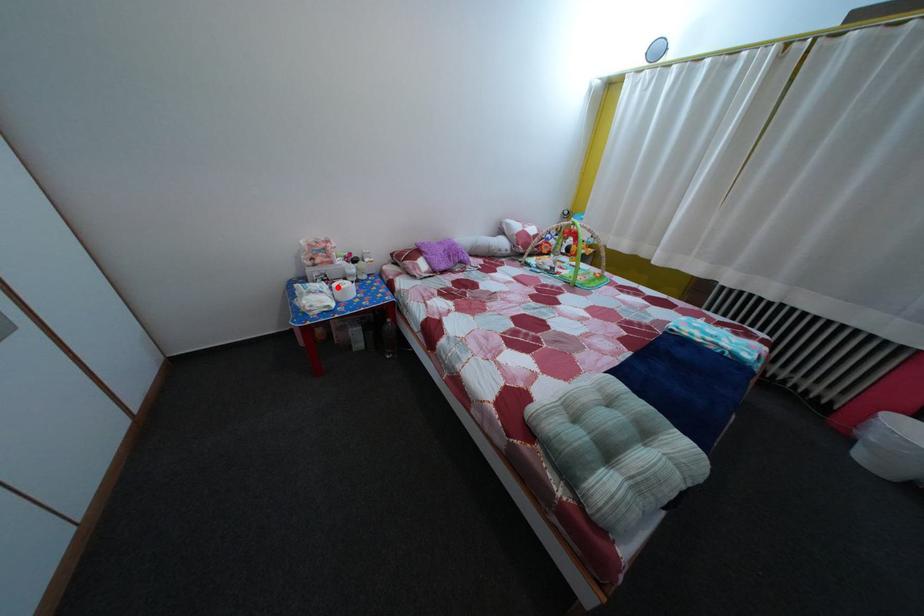
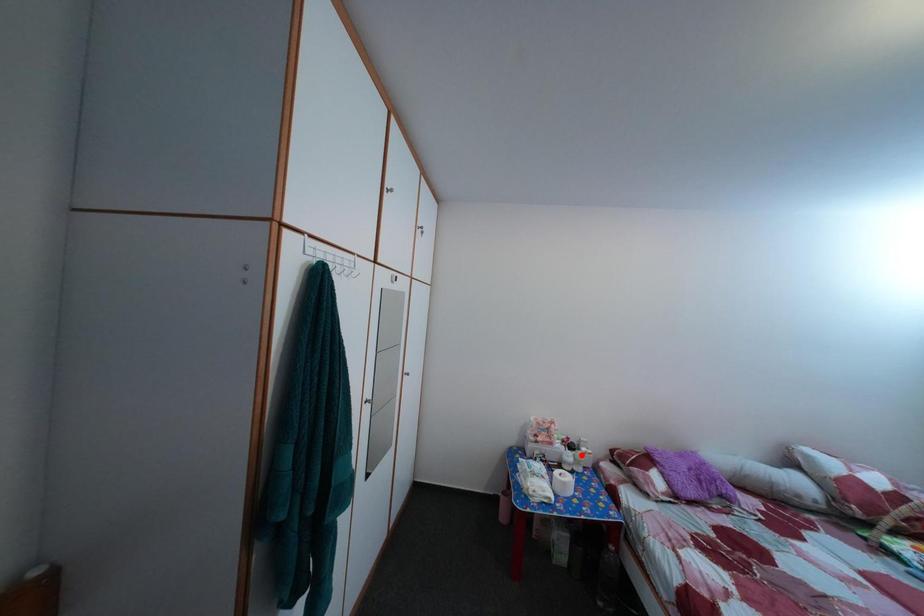
I am providing you with two images of the same scene from different viewpoints. A red point is marked on the first image and another point is marked on the second image. Is the marked point in image1 the same physical position as the marked point in image2?

No